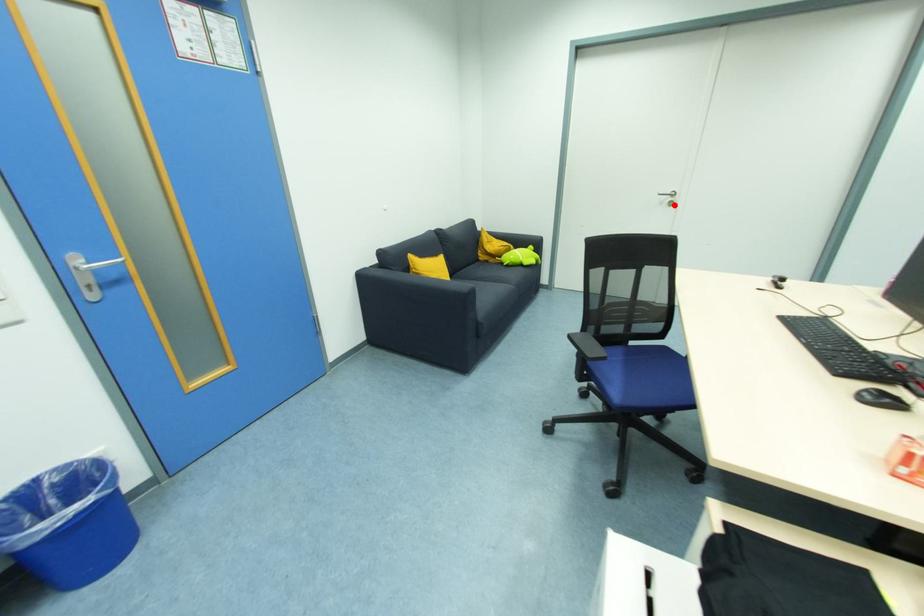
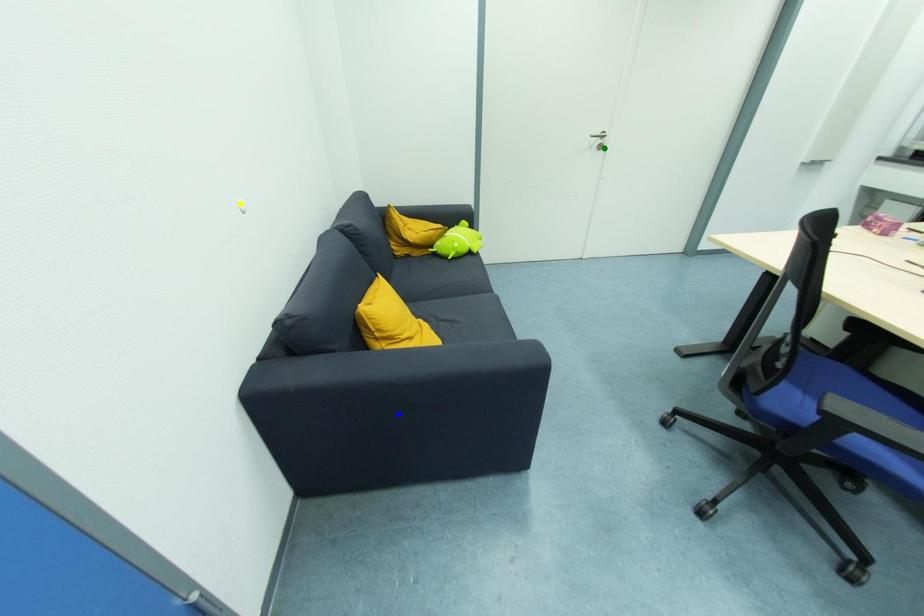
Question: I am providing you with two images of the same scene from different viewpoints. A red point is marked on the first image. You are given multiple points on the second image. In image 2, which mark is for the same physical point as the one in image 1?

Choices:
 (A) blue point
 (B) green point
 (C) yellow point

Answer: (B)